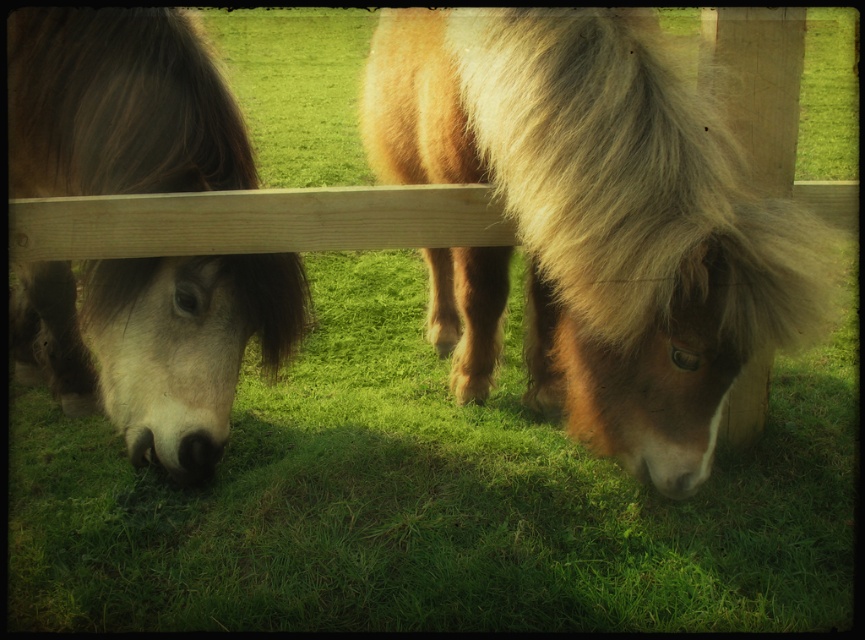
You are a farmer who wants to separate two animals using a fence. The brown fuzzy pony at center and the brown fuzzy horse at left are currently grazing near each other. Given that the fence you have can only be placed between them if they are at least 36 inches apart, can you safely place the fence between them?

The distance between the brown fuzzy pony at center and the brown fuzzy horse at left is 34.38 inches, which is less than the required 36 inches. Therefore, you cannot safely place the fence between them.

You are standing in front of the fence and want to place a small flag at the point closer to you. Which point should you choose between point (548,252) and point (15,193)?

Point (548,252) is closer to the camera than point (15,193), so you should choose point 0.395, 0.365 to place the flag.

You are standing in a field and see the brown fuzzy pony at center and the brown fuzzy horse at left. Which one is higher up in the image?

The brown fuzzy pony at center is higher up in the image than the brown fuzzy horse at left.